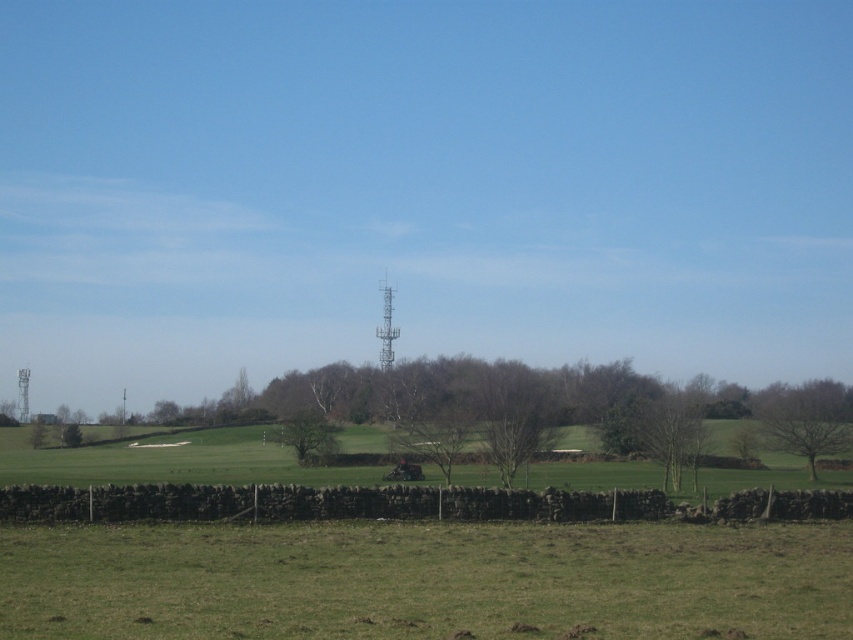
Can you confirm if green grass at lower center is positioned to the left of green leafy tree at lower left?

No, green grass at lower center is not to the left of green leafy tree at lower left.

In the scene shown: Does green grass at lower center appear over green leafy tree at lower left?

Yes, green grass at lower center is above green leafy tree at lower left.

Is point (555, 538) closer to camera compared to point (80, 435)?

Yes, it is in front of point (80, 435).

The height and width of the screenshot is (640, 853). I want to click on green grass at lower center, so click(x=426, y=580).

Can you confirm if bare branches at lower right is positioned below green leafy tree at center?

Incorrect, bare branches at lower right is not positioned below green leafy tree at center.

Can you confirm if bare branches at lower right is wider than green leafy tree at center?

No, bare branches at lower right is not wider than green leafy tree at center.

Between point (631, 416) and point (296, 458), which one is positioned in front?

Positioned in front is point (631, 416).

Find the location of a particular element. The width and height of the screenshot is (853, 640). bare branches at lower right is located at coordinates (670, 432).

Can you confirm if green grass at lower center is positioned above green leafy tree at center?

Yes.

You are a GUI agent. You are given a task and a screenshot of the screen. Output one action in this format:
    pyautogui.click(x=<x>, y=<y>)
    Task: Click on the green grass at lower center
    Image resolution: width=853 pixels, height=640 pixels.
    Given the screenshot: What is the action you would take?
    pyautogui.click(x=426, y=580)

Identify the location of green grass at lower center. The image size is (853, 640). (426, 580).